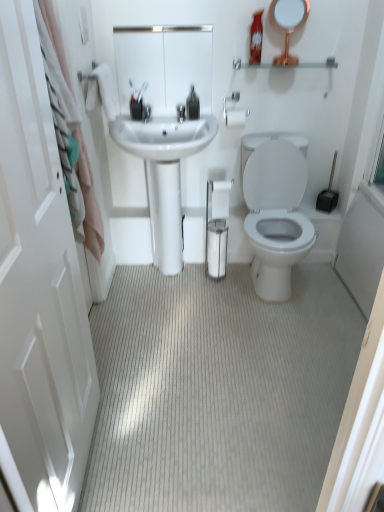
Question: Is gold metallic mirror at upper right, which appears as the first mirror when viewed from the right, positioned with its back to neutral carpet at center?

Choices:
 (A) no
 (B) yes

Answer: (A)

Question: Is the depth of gold metallic mirror at upper right, which appears as the 2th mirror when viewed from the left, less than that of neutral carpet at center?

Choices:
 (A) yes
 (B) no

Answer: (B)

Question: From the image's perspective, is gold metallic mirror at upper right, which appears as the first mirror when viewed from the right, on neutral carpet at center?

Choices:
 (A) yes
 (B) no

Answer: (A)

Question: From a real-world perspective, is gold metallic mirror at upper right, which appears as the first mirror when viewed from the right, physically above neutral carpet at center?

Choices:
 (A) yes
 (B) no

Answer: (A)

Question: Is gold metallic mirror at upper right, which appears as the 2th mirror when viewed from the left, to the left of neutral carpet at center from the viewer's perspective?

Choices:
 (A) yes
 (B) no

Answer: (B)

Question: In terms of size, does silver metallic towel bar at upper center appear bigger or smaller than white glossy mirror at upper center, placed as the first mirror when sorted from left to right?

Choices:
 (A) big
 (B) small

Answer: (B)

Question: Based on their positions, is silver metallic towel bar at upper center located to the left or right of white glossy mirror at upper center, placed as the first mirror when sorted from left to right?

Choices:
 (A) right
 (B) left

Answer: (A)

Question: Considering the positions of point (243, 114) and point (112, 33), is point (243, 114) closer or farther from the camera than point (112, 33)?

Choices:
 (A) closer
 (B) farther

Answer: (B)

Question: From the image's perspective, relative to white glossy mirror at upper center, placed as the first mirror when sorted from left to right, is silver metallic towel bar at upper center above or below?

Choices:
 (A) below
 (B) above

Answer: (A)

Question: From a real-world perspective, is white glossy sink at center above or below white matte toilet paper at center?

Choices:
 (A) below
 (B) above

Answer: (A)

Question: Considering the positions of point (147, 196) and point (225, 184), is point (147, 196) closer or farther from the camera than point (225, 184)?

Choices:
 (A) closer
 (B) farther

Answer: (B)

Question: Is white glossy sink at center in front of or behind white matte toilet paper at center in the image?

Choices:
 (A) behind
 (B) front

Answer: (B)

Question: In terms of height, does white glossy sink at center look taller or shorter compared to white matte toilet paper at center?

Choices:
 (A) short
 (B) tall

Answer: (B)

Question: Considering their positions, is white glossy sink at center located in front of or behind white glossy mirror at upper center, which is the second mirror from right to left?

Choices:
 (A) front
 (B) behind

Answer: (A)

Question: Is white glossy sink at center spatially inside white glossy mirror at upper center, which is the second mirror from right to left, or outside of it?

Choices:
 (A) inside
 (B) outside

Answer: (B)